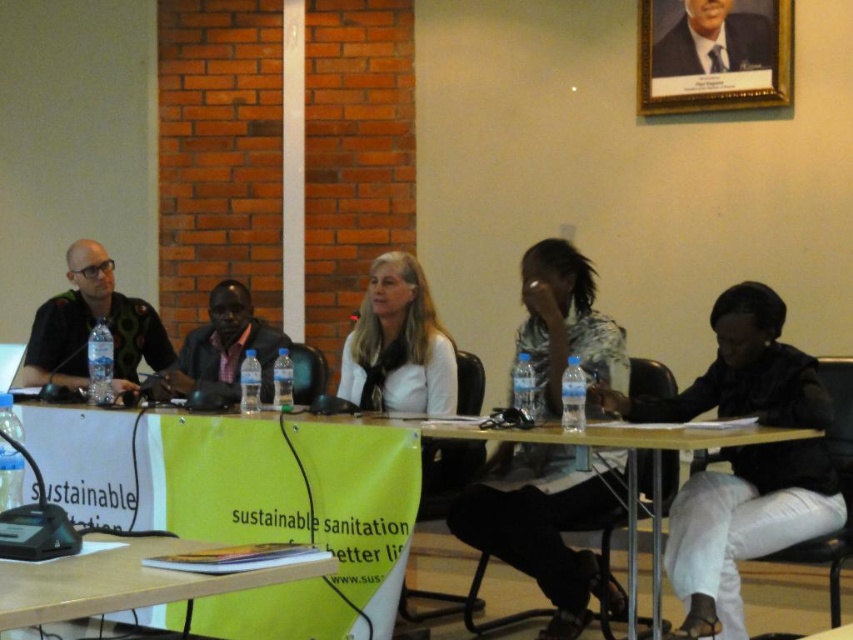
You are a photographer standing at the camera position. You want to capture a photo of the wooden table at center without any participants in the frame. Is the distance between you and the table sufficient to allow you to zoom in and focus on the table while keeping the participants out of the shot?

The wooden table at center and camera are 4.62 feet apart from each other. Since the distance is relatively short, zooming in might bring the table into focus but could also include the participants sitting around it. To exclude them, you might need to adjust your angle or use a longer focal length to compress the perspective, but the given distance may not be sufficient for a clean shot without participants.

You are attending a panel discussion and need to locate the black matte jacket at lower right. According to the coordinates provided, where exactly would you find it?

The black matte jacket at lower right is located at point (744, 525).